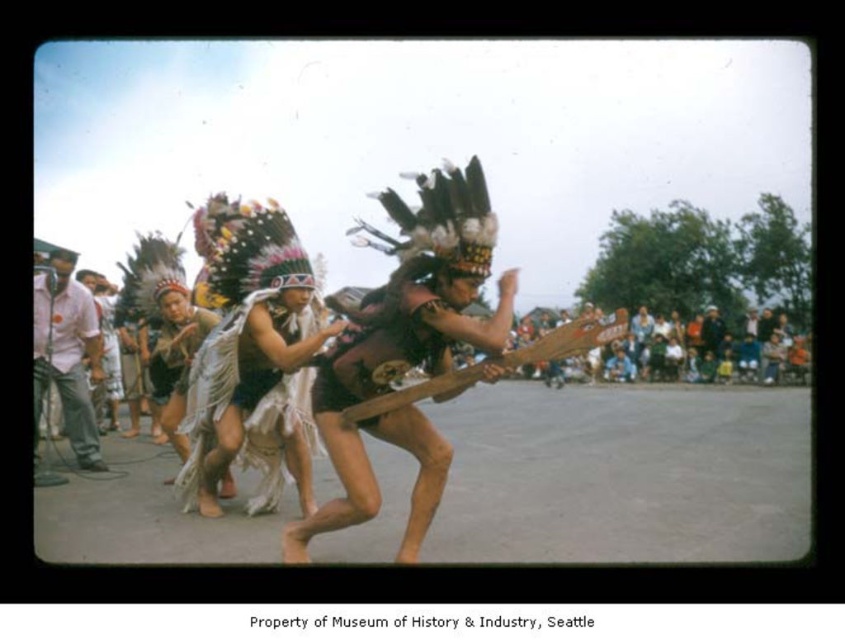
Which is behind, point (300, 371) or point (52, 381)?

The point (52, 381) is more distant.

Between white fringed fabric at center and white cotton shirt at left, which one appears on the left side from the viewer's perspective?

white cotton shirt at left is more to the left.

The width and height of the screenshot is (845, 640). What do you see at coordinates (249, 406) in the screenshot?
I see `white fringed fabric at center` at bounding box center [249, 406].

At what (x,y) coordinates should I click in order to perform the action: click on white fringed fabric at center. Please return your answer as a coordinate pair (x, y). This screenshot has height=640, width=845. Looking at the image, I should click on (249, 406).